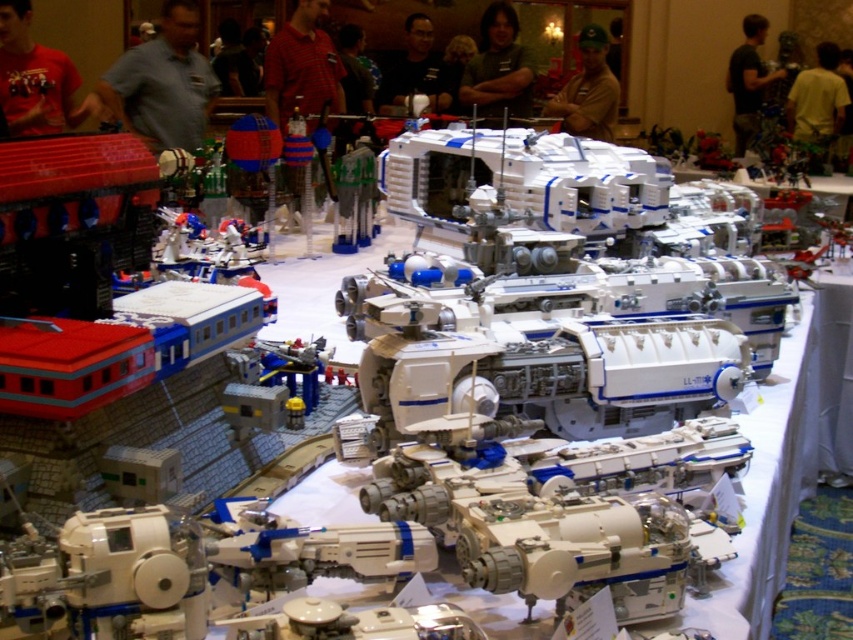
You are a photographer standing 2 meters away from the red plaid shirt at center and green shirt at center. You want to take a photo that includes both shirts in the frame. Can you do this without moving your position? Explain your reasoning based on the distance between them.

The red plaid shirt at center and green shirt at center are 1.30 meters apart. Since you are 2 meters away from both shirts, the distance between them is within the camera frame at that distance, so yes, you can capture both shirts in the photo without moving.

You are a photographer at the LEGO exhibition and want to take a photo of the yellow matte shirt at upper right and the dark brown shirt at upper right. However, you need to ensure that both shirts are fully visible in the frame. Based on their positions, which shirt should you focus on to make sure both are visible?

You should focus on the yellow matte shirt at upper right because it is in front of the dark brown shirt at upper right, so by focusing on the front shirt, both will be visible in the frame.

You are standing at the entrance of the LEGO exhibition and see two points marked in the image. The first point is at coordinate point (585, 49) and the second is at point (434, 109). Which point is closer to you?

Point (585, 49) is in front of point (434, 109), so the first point is closer to you.